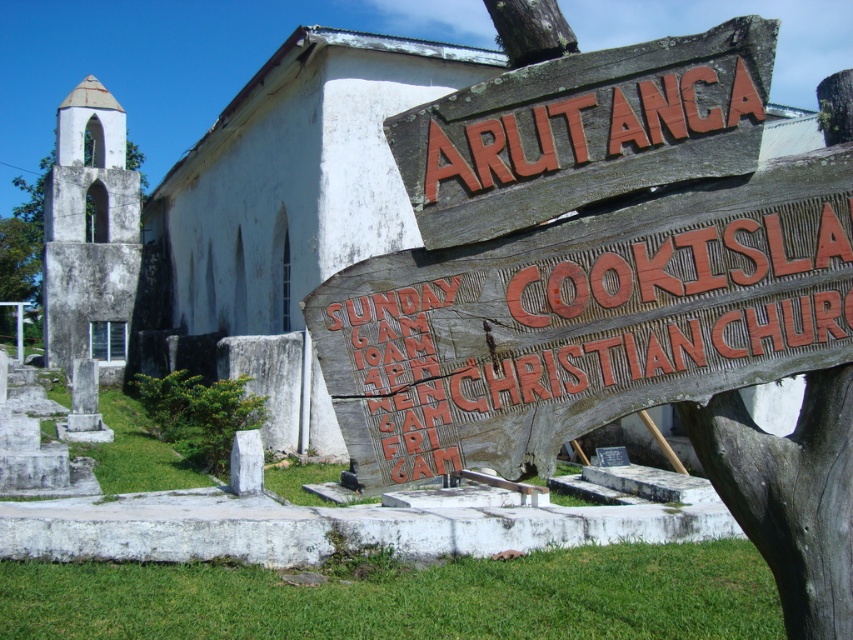
You are a visitor standing at the entrance of the white stone chapel at left and want to read the wooden sign at upper center. Can you see the entire sign without moving your head?

The wooden sign at upper center is not as tall as the white stone chapel at left, so yes, you can see the entire wooden sign at upper center without moving your head because it is shorter than the chapel.

You are standing at the point with coordinates point (474,148) and want to walk towards the point with coordinates point (724,282). Will the church block your path?

Point (724,282) is behind point (474,148), so the church will block your path to point (724,282).

You are standing in front of the small white church with a bell tower on the left. You see a weathered wood sign at center and a wooden sign at upper center. Which sign is positioned to the right side from your perspective?

The weathered wood sign at center is positioned to the right of the wooden sign at upper center.